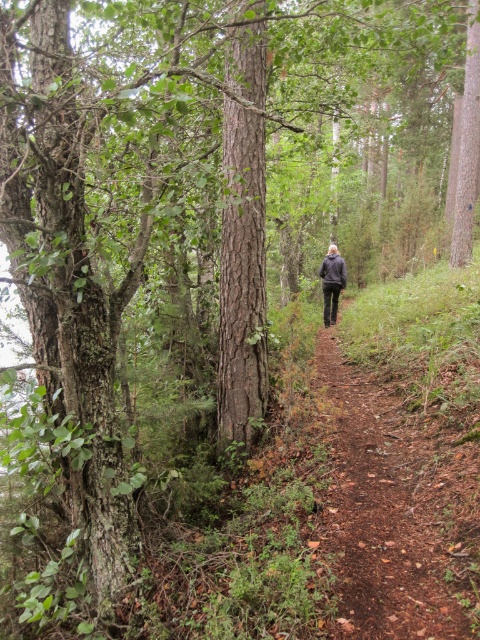
Question: Is brown dirt path at center below dark gray jacket at center?

Choices:
 (A) no
 (B) yes

Answer: (B)

Question: Can you confirm if brown dirt path at center is wider than dark gray jacket at center?

Choices:
 (A) no
 (B) yes

Answer: (B)

Question: Is brown dirt path at center smaller than dark gray jacket at center?

Choices:
 (A) no
 (B) yes

Answer: (A)

Question: Among these points, which one is nearest to the camera?

Choices:
 (A) (324, 273)
 (B) (372, 449)

Answer: (B)

Question: Which point is farther from the camera taking this photo?

Choices:
 (A) (343, 269)
 (B) (446, 632)

Answer: (A)